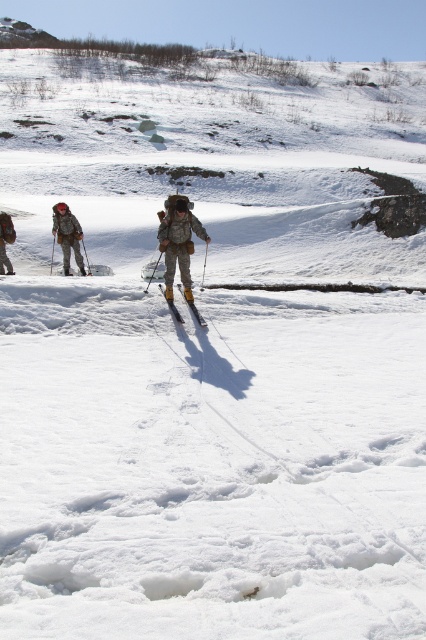
You are a photographer trying to capture a clear shot of the yellow metallic ski at center without the camouflage fabric backpack at left blocking it. Can you adjust your position to do so?

The camouflage fabric backpack at left is positioned over the yellow metallic ski at center, so moving your camera position slightly to the right or left might allow you to see the yellow metallic ski at center without obstruction.

You are a photographer trying to capture a clear shot of the camouflage fabric jacket at center and the yellow metallic ski at center in the snowy landscape. Which object should you focus on first to ensure it appears sharp in the photo?

The camouflage fabric jacket at center is above the yellow metallic ski at center, so you should focus on the camouflage fabric jacket at center first to ensure it appears sharp in the photo.